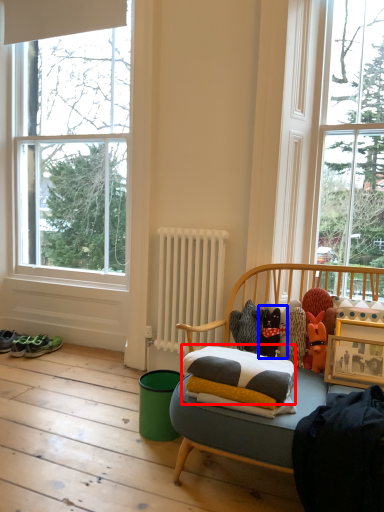
Question: Which object appears closest to the camera in this image, pillow (highlighted by a red box) or toy (highlighted by a blue box)?

Choices:
 (A) pillow
 (B) toy

Answer: (A)